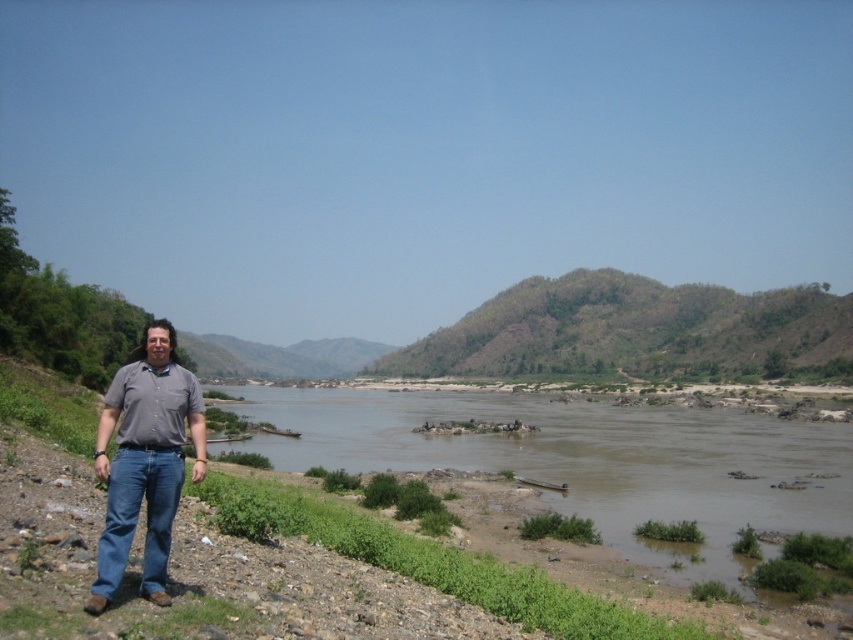
You are a photographer planning to take a photo of the brown muddy water at center and the denim jeans at left. Which object should you focus on first if you want to capture both in a single shot without moving the camera?

The brown muddy water at center is bigger than denim jeans at left, so you should focus on the brown muddy water at center first to ensure it fills the frame appropriately before adjusting for the smaller denim jeans at left.

You are a photographer standing at the riverside. You want to capture a closeup shot of the brown muddy water at center. Your camera can focus on objects up to 25 meters away. Can you take the photo without moving closer?

The brown muddy water at center and camera are 24.98 meters apart, so yes, you can take the photo without moving closer since the distance is within the camera focus range.